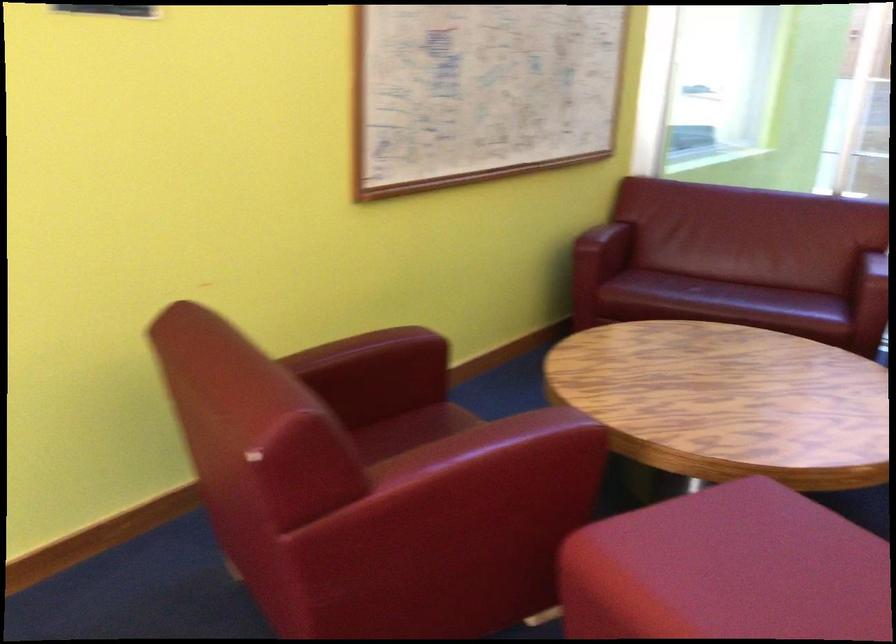
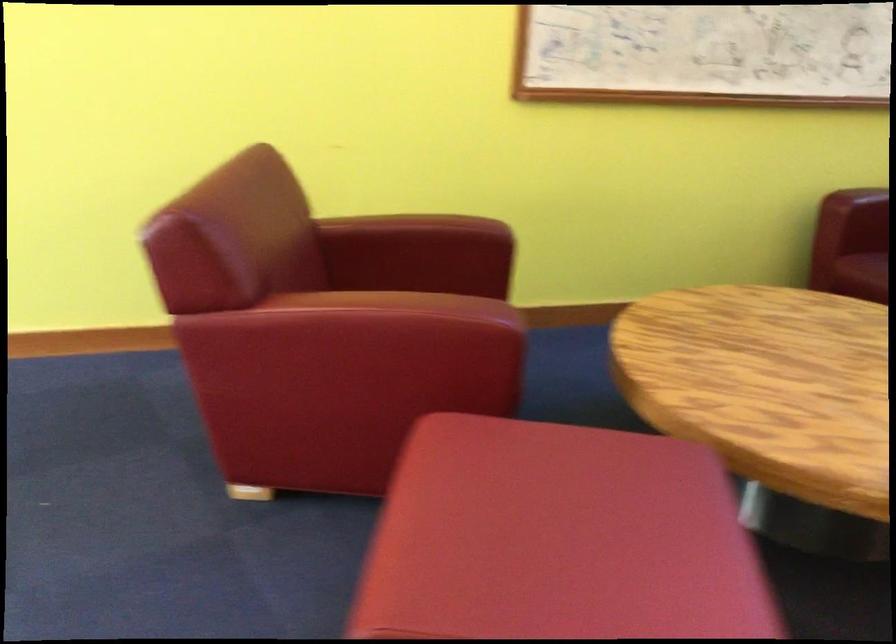
Question: I am providing you with two images of the same scene from different viewpoints. After the viewpoint changes to image2, which objects are now occluded?

Choices:
 (A) blue tissue box
 (B) chair sitting surface
 (C) red ottoman
 (D) red chair sitting surface

Answer: (B)